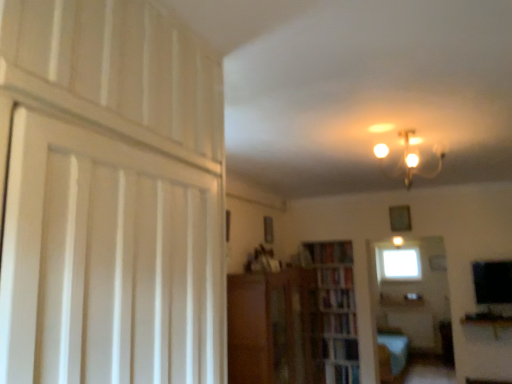
Where is `wooden bookshelf at center, which ranks as the first book in bottom-to-top order`? The height and width of the screenshot is (384, 512). wooden bookshelf at center, which ranks as the first book in bottom-to-top order is located at coordinates (340, 323).

You are a GUI agent. You are given a task and a screenshot of the screen. Output one action in this format:
    pyautogui.click(x=<x>, y=<y>)
    Task: Click on the white wood door at left
    The width and height of the screenshot is (512, 384).
    Given the screenshot: What is the action you would take?
    pyautogui.click(x=110, y=196)

The width and height of the screenshot is (512, 384). Identify the location of wooden bookshelf at center. (345, 349).

The height and width of the screenshot is (384, 512). What do you see at coordinates (336, 309) in the screenshot?
I see `wooden bookcase at center` at bounding box center [336, 309].

This screenshot has height=384, width=512. Identify the location of wooden bookshelf at center, placed as the 4th book when sorted from top to bottom. (340, 323).

Considering the positions of points (339, 304) and (399, 254), is point (339, 304) farther from camera compared to point (399, 254)?

No, it is in front of (399, 254).

From a real-world perspective, is hardcover book at center, acting as the 3th book starting from the top, positioned above or below transparent glass window at center?

In terms of real-world spatial position, hardcover book at center, acting as the 3th book starting from the top, is below transparent glass window at center.

How much distance is there between hardcover book at center, acting as the 3th book starting from the top, and transparent glass window at center?

hardcover book at center, acting as the 3th book starting from the top, and transparent glass window at center are 3.67 feet apart.

Can you confirm if wooden bookshelf at center is taller than transparent glass window at center?

No.

Which is in front, point (353, 356) or point (387, 264)?

Point (353, 356)

Can you confirm if wooden bookshelf at center is smaller than transparent glass window at center?

Yes.

From the image's perspective, which is below, hardcover book at center, marked as the second book in a top-to-bottom arrangement, or white wood door at left?

hardcover book at center, marked as the second book in a top-to-bottom arrangement, appears lower in the image.

Is hardcover book at center, marked as the second book in a top-to-bottom arrangement, inside or outside of white wood door at left?

hardcover book at center, marked as the second book in a top-to-bottom arrangement, is not inside white wood door at left, it's outside.

Is hardcover book at center, marked as the second book in a top-to-bottom arrangement, to the right of white wood door at left from the viewer's perspective?

Yes.

From the image's perspective, is wooden bookshelf at center located above white wood door at left?

No.

The image size is (512, 384). In the image, there is a white wood door at left. What are the coordinates of `shelf below it (from the image's perspective)` in the screenshot? It's located at (345, 349).

Between wooden bookshelf at center and white wood door at left, which one has less height?

With less height is wooden bookshelf at center.

Can you confirm if wooden bookshelf at center is positioned to the right of white wood door at left?

Yes.

Is wooden bookshelf at center taller or shorter than hardcover book at center, placed as the 1th book when sorted from top to bottom?

Considering their sizes, wooden bookshelf at center has less height than hardcover book at center, placed as the 1th book when sorted from top to bottom.

Based on the photo, does wooden bookshelf at center have a smaller size compared to hardcover book at center, placed as the 1th book when sorted from top to bottom?

Correct, wooden bookshelf at center occupies less space than hardcover book at center, placed as the 1th book when sorted from top to bottom.

Is point (343, 358) closer to camera compared to point (314, 246)?

Yes, it is in front of point (314, 246).

Is wooden bookshelf at center outside of hardcover book at center, placed as the 1th book when sorted from top to bottom?

Yes.

Can you tell me how much white wood door at left and wooden bookshelf at center differ in facing direction?

The facing directions of white wood door at left and wooden bookshelf at center are 91.8 degrees apart.

Locate an element on the screen. The width and height of the screenshot is (512, 384). shelf below the white wood door at left (from the image's perspective) is located at coordinates (345, 349).

Is white wood door at left oriented towards wooden bookshelf at center?

No, white wood door at left is not turned towards wooden bookshelf at center.

Considering the positions of objects white wood door at left and wooden bookshelf at center in the image provided, who is more to the left, white wood door at left or wooden bookshelf at center?

Positioned to the left is white wood door at left.

This screenshot has width=512, height=384. Identify the location of the 2nd book to the right when counting from the hardcover book at center, placed as the 1th book when sorted from top to bottom. (340, 323).

Looking at the image, does wooden bookshelf at center, placed as the 4th book when sorted from top to bottom, seem bigger or smaller compared to hardcover book at center, positioned as the 4th book in bottom-to-top order?

In the image, wooden bookshelf at center, placed as the 4th book when sorted from top to bottom, appears to be smaller than hardcover book at center, positioned as the 4th book in bottom-to-top order.

Can hardcover book at center, placed as the 1th book when sorted from top to bottom, be found inside wooden bookshelf at center, which ranks as the first book in bottom-to-top order?

No, wooden bookshelf at center, which ranks as the first book in bottom-to-top order, does not contain hardcover book at center, placed as the 1th book when sorted from top to bottom.

From the image's perspective, is wooden bookshelf at center, placed as the 4th book when sorted from top to bottom, on hardcover book at center, placed as the 1th book when sorted from top to bottom?

Incorrect, from the image's perspective, wooden bookshelf at center, placed as the 4th book when sorted from top to bottom, is lower than hardcover book at center, placed as the 1th book when sorted from top to bottom.

Where is `book that is the 1st one when counting leftward from the transparent glass window at center`? Image resolution: width=512 pixels, height=384 pixels. book that is the 1st one when counting leftward from the transparent glass window at center is located at coordinates (337, 298).

I want to click on window on the right side of wooden bookshelf at center, so click(x=401, y=264).

Looking at the image, which one is located further to hardcover book at center, positioned as the 4th book in bottom-to-top order, wooden bookshelf at center or white wood door at left?

white wood door at left lies further to hardcover book at center, positioned as the 4th book in bottom-to-top order, than the other object.

Looking at the image, which one is located further to hardcover book at center, the third book when ordered from bottom to top, wooden bookcase at center or wooden bookshelf at center?

Among the two, wooden bookshelf at center is located further to hardcover book at center, the third book when ordered from bottom to top.

Estimate the real-world distances between objects in this image. Which object is further from wooden bookcase at center, hardcover book at center, marked as the second book in a top-to-bottom arrangement, or hardcover book at center, acting as the 3th book starting from the top?

The object further to wooden bookcase at center is hardcover book at center, marked as the second book in a top-to-bottom arrangement.

Considering their positions, is wooden bookshelf at center, placed as the 4th book when sorted from top to bottom, positioned further to wooden bookcase at center than hardcover book at center, the third book when ordered from bottom to top?

The object further to wooden bookcase at center is hardcover book at center, the third book when ordered from bottom to top.

Looking at the image, which one is located closer to wooden bookshelf at center, placed as the 4th book when sorted from top to bottom, white wood door at left or hardcover book at center, marked as the second book in a top-to-bottom arrangement?

hardcover book at center, marked as the second book in a top-to-bottom arrangement.

Which object lies nearer to the anchor point transparent glass window at center, white wood door at left or wooden bookshelf at center?

wooden bookshelf at center is positioned closer to the anchor transparent glass window at center.

Estimate the real-world distances between objects in this image. Which object is further from wooden cabinet at center, wooden bookcase at center or white wood door at left?

white wood door at left is positioned further to the anchor wooden cabinet at center.

From the image, which object appears to be farther from wooden bookshelf at center, wooden bookcase at center or hardcover book at center, acting as the 3th book starting from the top?

Among the two, hardcover book at center, acting as the 3th book starting from the top, is located further to wooden bookshelf at center.

In order to click on bookcase between matte glass chandelier at upper center and hardcover book at center, acting as the 3th book starting from the top, along the z-axis in this screenshot , I will do `click(336, 309)`.

The image size is (512, 384). Find the location of `bookcase that lies between hardcover book at center, acting as the 3th book starting from the top, and wooden bookshelf at center from top to bottom`. bookcase that lies between hardcover book at center, acting as the 3th book starting from the top, and wooden bookshelf at center from top to bottom is located at coordinates (336, 309).

In order to click on shelf located between matte glass chandelier at upper center and transparent glass window at center in the depth direction in this screenshot , I will do `click(345, 349)`.

The image size is (512, 384). I want to click on book that lies between hardcover book at center, positioned as the 4th book in bottom-to-top order, and hardcover book at center, which ranks as the 2th book in bottom-to-top order, from top to bottom, so click(x=336, y=277).